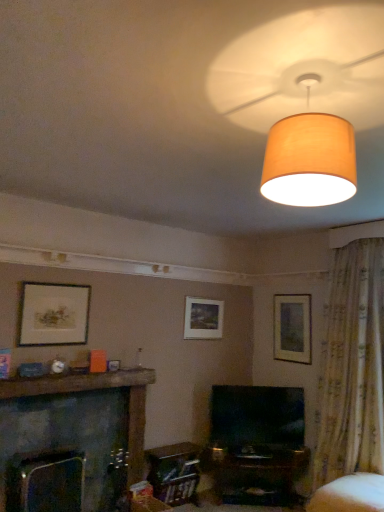
Question: Is black glossy tv at center located within white fabric swivel chair at lower right?

Choices:
 (A) no
 (B) yes

Answer: (A)

Question: Is white fabric swivel chair at lower right positioned with its back to black glossy tv at center?

Choices:
 (A) yes
 (B) no

Answer: (B)

Question: Can you confirm if white fabric swivel chair at lower right is wider than black glossy tv at center?

Choices:
 (A) yes
 (B) no

Answer: (A)

Question: Considering the relative positions of white fabric swivel chair at lower right and black glossy tv at center in the image provided, is white fabric swivel chair at lower right to the right of black glossy tv at center from the viewer's perspective?

Choices:
 (A) yes
 (B) no

Answer: (A)

Question: Considering the relative sizes of white fabric swivel chair at lower right and black glossy tv at center in the image provided, is white fabric swivel chair at lower right thinner than black glossy tv at center?

Choices:
 (A) yes
 (B) no

Answer: (B)

Question: From the image's perspective, is white fabric swivel chair at lower right located above or below matte beige lampshade at upper center?

Choices:
 (A) below
 (B) above

Answer: (A)

Question: Based on their positions, is white fabric swivel chair at lower right located to the left or right of matte beige lampshade at upper center?

Choices:
 (A) left
 (B) right

Answer: (B)

Question: From a real-world perspective, is white fabric swivel chair at lower right physically located above or below matte beige lampshade at upper center?

Choices:
 (A) above
 (B) below

Answer: (B)

Question: Considering the positions of white fabric swivel chair at lower right and matte beige lampshade at upper center in the image, is white fabric swivel chair at lower right bigger or smaller than matte beige lampshade at upper center?

Choices:
 (A) big
 (B) small

Answer: (A)

Question: In terms of width, does matte gold picture frame at left, the 3th picture frame viewed from the back, look wider or thinner when compared to dark gray stone fireplace at lower left?

Choices:
 (A) thin
 (B) wide

Answer: (A)

Question: In the image, is matte gold picture frame at left, the third picture frame positioned from the right, positioned in front of or behind dark gray stone fireplace at lower left?

Choices:
 (A) front
 (B) behind

Answer: (B)

Question: From their relative heights in the image, would you say matte gold picture frame at left, the 3th picture frame viewed from the back, is taller or shorter than dark gray stone fireplace at lower left?

Choices:
 (A) tall
 (B) short

Answer: (B)

Question: From the image's perspective, relative to dark gray stone fireplace at lower left, is matte gold picture frame at left, the 3th picture frame viewed from the back, above or below?

Choices:
 (A) above
 (B) below

Answer: (A)

Question: Is point (336, 24) closer or farther from the camera than point (215, 323)?

Choices:
 (A) closer
 (B) farther

Answer: (A)

Question: Would you say matte beige lampshade at upper center is to the left or to the right of matte white picture frame at center, the 2th picture frame positioned from the right, in the picture?

Choices:
 (A) left
 (B) right

Answer: (B)